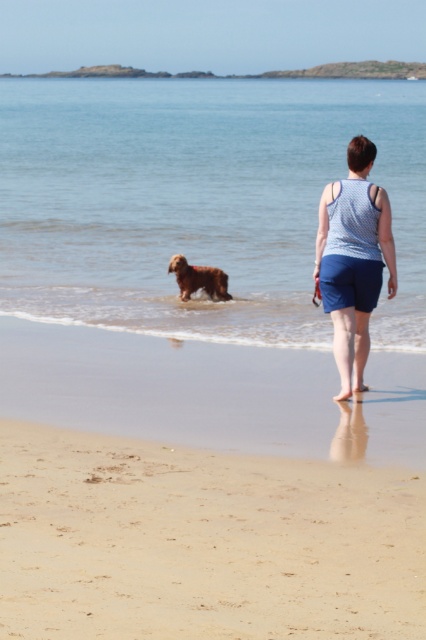
Question: Observing the image, what is the correct spatial positioning of fine-grained sand at lower center in reference to golden brown fur at center?

Choices:
 (A) right
 (B) left

Answer: (A)

Question: Which point is closer to the camera?

Choices:
 (A) (175, 275)
 (B) (8, 509)
 (C) (365, 284)
 (D) (115, 129)

Answer: (B)

Question: Does fine-grained sand at lower center lie in front of blue cotton tank top at center?

Choices:
 (A) no
 (B) yes

Answer: (B)

Question: Which point is farther to the camera?

Choices:
 (A) blue cotton tank top at center
 (B) fine-grained sand at lower center
 (C) clear water at dog center

Answer: (C)

Question: Which point is farther to the camera?

Choices:
 (A) fine-grained sand at lower center
 (B) golden brown fur at center
 (C) clear water at dog center

Answer: (B)

Question: Does blue cotton tank top at center have a greater width compared to golden brown fur at center?

Choices:
 (A) yes
 (B) no

Answer: (B)